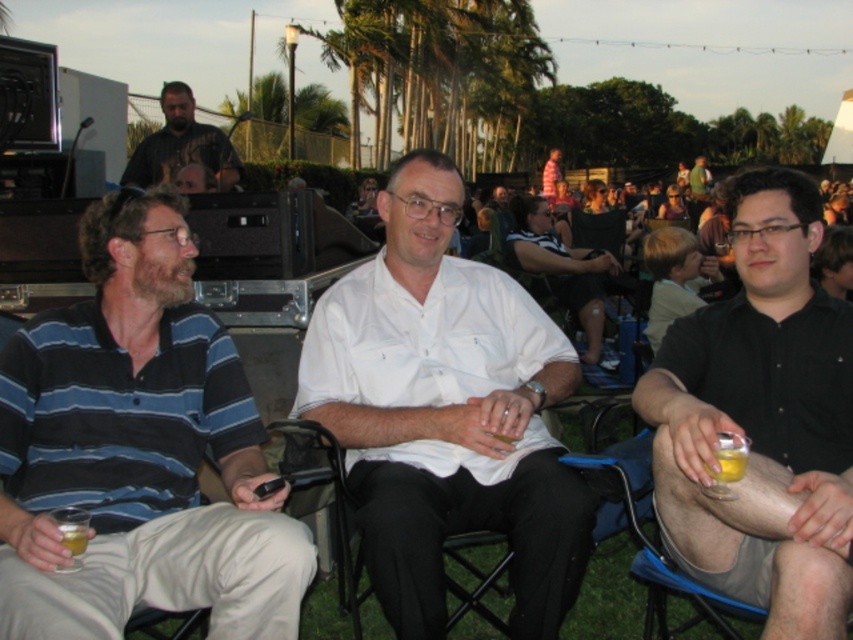
Question: Can you confirm if blue striped polo shirt at left is positioned below translucent yellow liquid at lower right?

Choices:
 (A) yes
 (B) no

Answer: (B)

Question: Does blue striped polo shirt at left have a smaller size compared to black shirt at right?

Choices:
 (A) yes
 (B) no

Answer: (B)

Question: Which of the following is the farthest from the observer?

Choices:
 (A) (155, 156)
 (B) (122, 577)

Answer: (A)

Question: Which point is farther from the camera taking this photo?

Choices:
 (A) (737, 440)
 (B) (676, 448)
 (C) (84, 520)

Answer: (B)

Question: Among these points, which one is nearest to the camera?

Choices:
 (A) (817, 612)
 (B) (552, 486)

Answer: (A)

Question: Does translucent yellow liquid at lower right lie behind translucent glass at lower left?

Choices:
 (A) yes
 (B) no

Answer: (B)